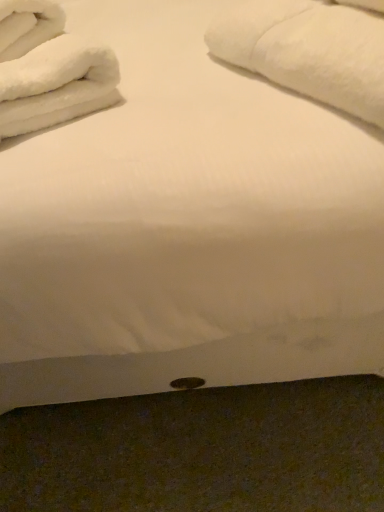
What do you see at coordinates (49, 69) in the screenshot? I see `white fluffy towels at upper left, placed as the 1th bath towel when sorted from left to right` at bounding box center [49, 69].

You are a GUI agent. You are given a task and a screenshot of the screen. Output one action in this format:
    pyautogui.click(x=<x>, y=<y>)
    Task: Click on the white fluffy towels at upper left, placed as the 1th bath towel when sorted from left to right
    
    Given the screenshot: What is the action you would take?
    pyautogui.click(x=49, y=69)

You are a GUI agent. You are given a task and a screenshot of the screen. Output one action in this format:
    pyautogui.click(x=<x>, y=<y>)
    Task: Click on the white soft towel at upper right, which appears as the second bath towel when viewed from the left
    The width and height of the screenshot is (384, 512).
    Given the screenshot: What is the action you would take?
    pyautogui.click(x=310, y=51)

What is the approximate height of white soft towel at upper right, the first bath towel in the right-to-left sequence?

It is 5.76 inches.

Describe the element at coordinates (310, 51) in the screenshot. The image size is (384, 512). I see `white soft towel at upper right, the first bath towel in the right-to-left sequence` at that location.

How much space does white soft towel at upper right, the first bath towel in the right-to-left sequence, occupy horizontally?

14.67 inches.

At what (x,y) coordinates should I click in order to perform the action: click on white fluffy towels at upper left, positioned as the second bath towel in right-to-left order. Please return your answer as a coordinate pair (x, y). This screenshot has width=384, height=512. Looking at the image, I should click on (49, 69).

From the picture: Does white fluffy towels at upper left, positioned as the second bath towel in right-to-left order, appear on the right side of white soft towel at upper right, which appears as the second bath towel when viewed from the left?

No, white fluffy towels at upper left, positioned as the second bath towel in right-to-left order, is not to the right of white soft towel at upper right, which appears as the second bath towel when viewed from the left.

Does white fluffy towels at upper left, positioned as the second bath towel in right-to-left order, lie behind white soft towel at upper right, which appears as the second bath towel when viewed from the left?

Yes, the depth of white fluffy towels at upper left, positioned as the second bath towel in right-to-left order, is greater than that of white soft towel at upper right, which appears as the second bath towel when viewed from the left.

Considering the points (14, 59) and (233, 21), which point is behind, point (14, 59) or point (233, 21)?

Point (233, 21)

From the image's perspective, which one is positioned lower, white fluffy towels at upper left, placed as the 1th bath towel when sorted from left to right, or white soft towel at upper right, the first bath towel in the right-to-left sequence?

white fluffy towels at upper left, placed as the 1th bath towel when sorted from left to right, from the image's perspective.

From a real-world perspective, is white fluffy towels at upper left, placed as the 1th bath towel when sorted from left to right, positioned above or below white soft towel at upper right, which appears as the second bath towel when viewed from the left?

white fluffy towels at upper left, placed as the 1th bath towel when sorted from left to right, is below white soft towel at upper right, which appears as the second bath towel when viewed from the left.

Considering the relative sizes of white fluffy towels at upper left, positioned as the second bath towel in right-to-left order, and white soft towel at upper right, the first bath towel in the right-to-left sequence, in the image provided, is white fluffy towels at upper left, positioned as the second bath towel in right-to-left order, thinner than white soft towel at upper right, the first bath towel in the right-to-left sequence,?

In fact, white fluffy towels at upper left, positioned as the second bath towel in right-to-left order, might be wider than white soft towel at upper right, the first bath towel in the right-to-left sequence.

Does white fluffy towels at upper left, placed as the 1th bath towel when sorted from left to right, have a lesser height compared to white soft towel at upper right, the first bath towel in the right-to-left sequence?

Correct, white fluffy towels at upper left, placed as the 1th bath towel when sorted from left to right, is not as tall as white soft towel at upper right, the first bath towel in the right-to-left sequence.

Is white fluffy towels at upper left, placed as the 1th bath towel when sorted from left to right, bigger than white soft towel at upper right, the first bath towel in the right-to-left sequence?

No, white fluffy towels at upper left, placed as the 1th bath towel when sorted from left to right, is not bigger than white soft towel at upper right, the first bath towel in the right-to-left sequence.

Is white fluffy towels at upper left, positioned as the second bath towel in right-to-left order, spatially inside white soft towel at upper right, the first bath towel in the right-to-left sequence, or outside of it?

white fluffy towels at upper left, positioned as the second bath towel in right-to-left order, is located beyond the bounds of white soft towel at upper right, the first bath towel in the right-to-left sequence.

Is white fluffy towels at upper left, placed as the 1th bath towel when sorted from left to right, not near white soft towel at upper right, which appears as the second bath towel when viewed from the left?

No, white fluffy towels at upper left, placed as the 1th bath towel when sorted from left to right, is not far away from white soft towel at upper right, which appears as the second bath towel when viewed from the left.

Is white fluffy towels at upper left, placed as the 1th bath towel when sorted from left to right, aimed at white soft towel at upper right, which appears as the second bath towel when viewed from the left?

No, white fluffy towels at upper left, placed as the 1th bath towel when sorted from left to right, is not oriented towards white soft towel at upper right, which appears as the second bath towel when viewed from the left.

How distant is white fluffy towels at upper left, placed as the 1th bath towel when sorted from left to right, from white soft towel at upper right, the first bath towel in the right-to-left sequence?

The distance of white fluffy towels at upper left, placed as the 1th bath towel when sorted from left to right, from white soft towel at upper right, the first bath towel in the right-to-left sequence, is 10.78 inches.

This screenshot has height=512, width=384. I want to click on bath towel in front of the white fluffy towels at upper left, placed as the 1th bath towel when sorted from left to right, so (x=310, y=51).

Based on the photo, considering the positions of objects white soft towel at upper right, the first bath towel in the right-to-left sequence, and white fluffy towels at upper left, positioned as the second bath towel in right-to-left order, in the image provided, who is more to the left, white soft towel at upper right, the first bath towel in the right-to-left sequence, or white fluffy towels at upper left, positioned as the second bath towel in right-to-left order,?

white fluffy towels at upper left, positioned as the second bath towel in right-to-left order, is more to the left.

Is white soft towel at upper right, the first bath towel in the right-to-left sequence, closer to the viewer compared to white fluffy towels at upper left, positioned as the second bath towel in right-to-left order?

Yes, white soft towel at upper right, the first bath towel in the right-to-left sequence, is in front of white fluffy towels at upper left, positioned as the second bath towel in right-to-left order.

Which is in front, point (370, 25) or point (1, 76)?

Point (370, 25)

From the image's perspective, is white soft towel at upper right, the first bath towel in the right-to-left sequence, over white fluffy towels at upper left, positioned as the second bath towel in right-to-left order?

Correct, white soft towel at upper right, the first bath towel in the right-to-left sequence, appears higher than white fluffy towels at upper left, positioned as the second bath towel in right-to-left order, in the image.

From a real-world perspective, between white soft towel at upper right, which appears as the second bath towel when viewed from the left, and white fluffy towels at upper left, placed as the 1th bath towel when sorted from left to right, who is vertically lower?

white fluffy towels at upper left, placed as the 1th bath towel when sorted from left to right.

Which of these two, white soft towel at upper right, the first bath towel in the right-to-left sequence, or white fluffy towels at upper left, placed as the 1th bath towel when sorted from left to right, is thinner?

white soft towel at upper right, the first bath towel in the right-to-left sequence.

Between white soft towel at upper right, the first bath towel in the right-to-left sequence, and white fluffy towels at upper left, placed as the 1th bath towel when sorted from left to right, which one has more height?

With more height is white soft towel at upper right, the first bath towel in the right-to-left sequence.

Who is smaller, white soft towel at upper right, the first bath towel in the right-to-left sequence, or white fluffy towels at upper left, placed as the 1th bath towel when sorted from left to right?

With smaller size is white fluffy towels at upper left, placed as the 1th bath towel when sorted from left to right.

Is white soft towel at upper right, the first bath towel in the right-to-left sequence, situated inside white fluffy towels at upper left, placed as the 1th bath towel when sorted from left to right, or outside?

The correct answer is: outside.

Is white soft towel at upper right, the first bath towel in the right-to-left sequence, not close to white fluffy towels at upper left, positioned as the second bath towel in right-to-left order?

white soft towel at upper right, the first bath towel in the right-to-left sequence, is actually quite close to white fluffy towels at upper left, positioned as the second bath towel in right-to-left order.

Is white soft towel at upper right, the first bath towel in the right-to-left sequence, positioned with its back to white fluffy towels at upper left, positioned as the second bath towel in right-to-left order?

white soft towel at upper right, the first bath towel in the right-to-left sequence, does not have its back to white fluffy towels at upper left, positioned as the second bath towel in right-to-left order.

Can you tell me how much white soft towel at upper right, the first bath towel in the right-to-left sequence, and white fluffy towels at upper left, positioned as the second bath towel in right-to-left order, differ in facing direction?

They differ by 8.78 degrees in their facing directions.

You are a GUI agent. You are given a task and a screenshot of the screen. Output one action in this format:
    pyautogui.click(x=<x>, y=<y>)
    Task: Click on the bath towel lying in front of the white fluffy towels at upper left, positioned as the second bath towel in right-to-left order
    
    Given the screenshot: What is the action you would take?
    pyautogui.click(x=310, y=51)

Find the location of a particular element. This screenshot has width=384, height=512. bath towel in front of the white fluffy towels at upper left, placed as the 1th bath towel when sorted from left to right is located at coordinates (310, 51).

Where is `bath towel on the left of white soft towel at upper right, the first bath towel in the right-to-left sequence`? bath towel on the left of white soft towel at upper right, the first bath towel in the right-to-left sequence is located at coordinates (49, 69).